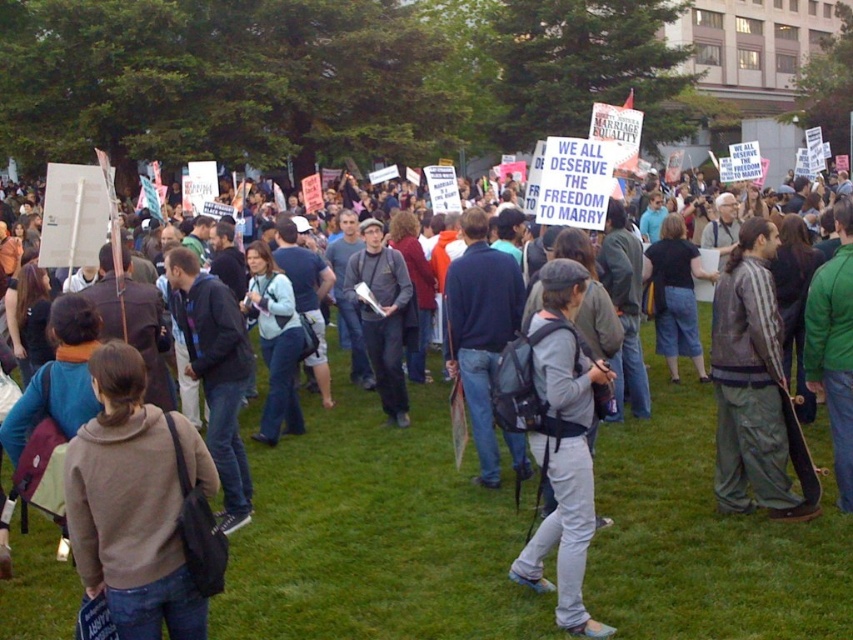
Is green grass at center above gray fabric backpack at center?

Incorrect, green grass at center is not positioned above gray fabric backpack at center.

Is point (659, 499) closer to viewer compared to point (583, 282)?

That is False.

This screenshot has height=640, width=853. I want to click on green grass at center, so click(x=376, y=536).

What do you see at coordinates (753, 388) in the screenshot?
I see `striped leather jacket at center` at bounding box center [753, 388].

Is striped leather jacket at center below matte gray jacket at center?

Indeed, striped leather jacket at center is positioned under matte gray jacket at center.

Is point (756, 349) closer to viewer compared to point (399, 300)?

Yes, it is in front of point (399, 300).

This screenshot has height=640, width=853. Identify the location of striped leather jacket at center. (753, 388).

How much distance is there between green grass at center and matte gray jacket at center?

The distance of green grass at center from matte gray jacket at center is 8.72 feet.

Which is in front, point (619, 508) or point (372, 220)?

Point (619, 508) is in front.

Where is `green grass at center`? green grass at center is located at coordinates (376, 536).